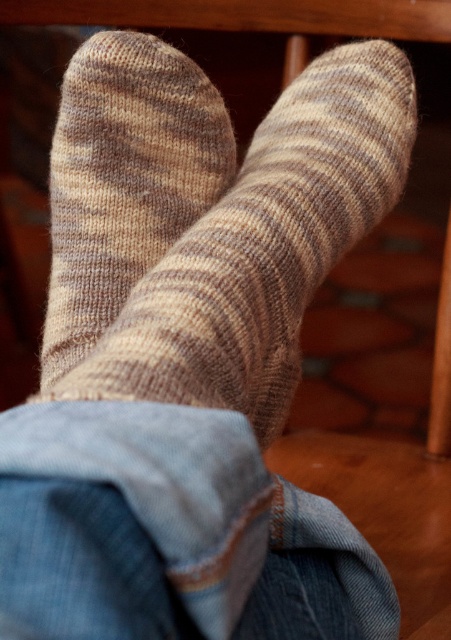
Question: Among these objects, which one is nearest to the camera?

Choices:
 (A) knit woolen socks at center
 (B) knit brown socks at center

Answer: (A)

Question: Can you confirm if knit woolen socks at center is wider than denim at lower left?

Choices:
 (A) no
 (B) yes

Answer: (B)

Question: Which of these objects is positioned closest to the denim at lower left?

Choices:
 (A) knit woolen socks at center
 (B) knit brown socks at center

Answer: (A)

Question: Does knit brown socks at center appear under denim at lower left?

Choices:
 (A) no
 (B) yes

Answer: (A)

Question: From the image, what is the correct spatial relationship of knit brown socks at center in relation to denim at lower left?

Choices:
 (A) left
 (B) right

Answer: (A)

Question: Which of the following is the farthest from the observer?

Choices:
 (A) knit brown socks at center
 (B) knit woolen socks at center

Answer: (A)